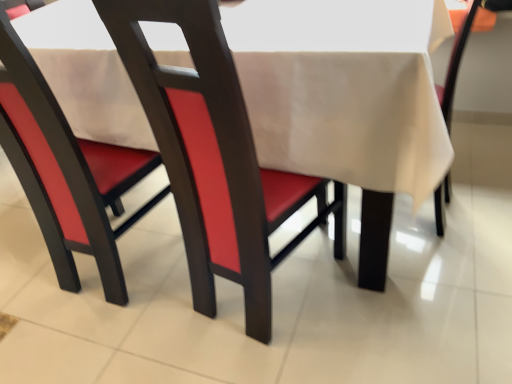
What are the coordinates of `vacant region in front of beige fabric chair at center, the 3th chair from the left` in the screenshot? It's located at (429, 281).